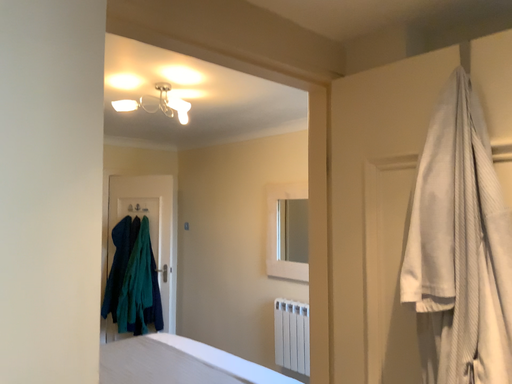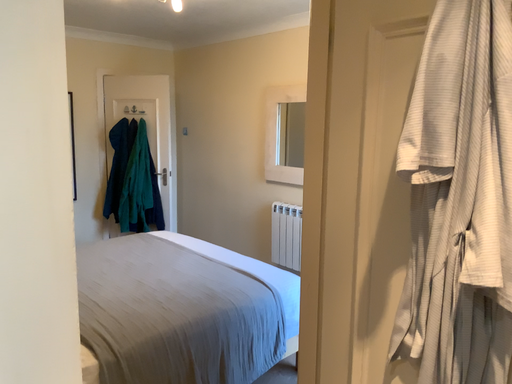
Question: How did the camera likely rotate when shooting the video?

Choices:
 (A) rotated downward
 (B) rotated upward

Answer: (A)